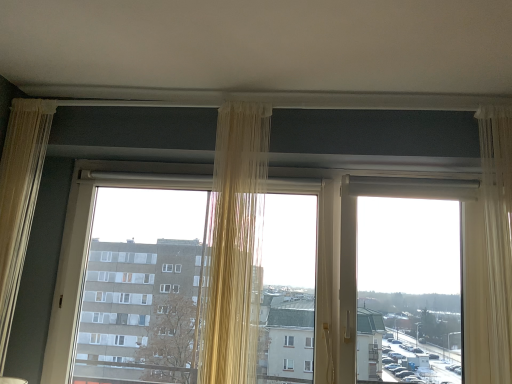
Question: Does point (245, 220) appear closer or farther from the camera than point (490, 112)?

Choices:
 (A) farther
 (B) closer

Answer: (B)

Question: From a real-world perspective, is translucent beige curtain at center, positioned as the 2th curtain in right-to-left order, positioned above or below sheer white curtain at right, the first curtain in the right-to-left sequence?

Choices:
 (A) above
 (B) below

Answer: (B)

Question: Estimate the real-world distances between objects in this image. Which object is farther from the transparent plastic window screen at right?

Choices:
 (A) sheer beige curtain at left, the 1th curtain from the left
 (B) translucent beige curtain at center, the second curtain positioned from the left
 (C) sheer white curtain at right, the first curtain in the right-to-left sequence
 (D) translucent fabric at center

Answer: (A)

Question: Which of these objects is positioned farthest from the sheer white curtain at right, the first curtain in the right-to-left sequence?

Choices:
 (A) translucent fabric at center
 (B) sheer beige curtain at left, the 3th curtain positioned from the right
 (C) translucent beige curtain at center, positioned as the 2th curtain in right-to-left order
 (D) transparent plastic window screen at right

Answer: (B)